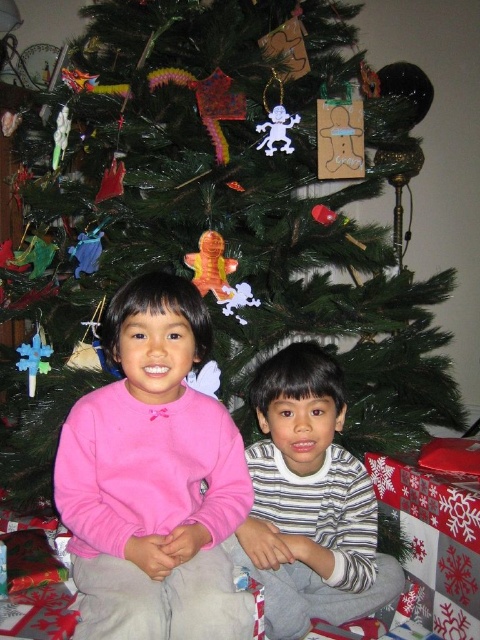
You are a photographer trying to capture a clear photo of the pink fleece sweater at center and the striped cotton shirt at lower center. Since the sweater is in front of the shirt, which object should you focus on to ensure both are in focus?

To ensure both the pink fleece sweater at center and the striped cotton shirt at lower center are in focus, focus on the pink fleece sweater at center since it is closer to the camera and in front of the striped cotton shirt at lower center. This will keep both objects sharp as the background will naturally fall into focus.